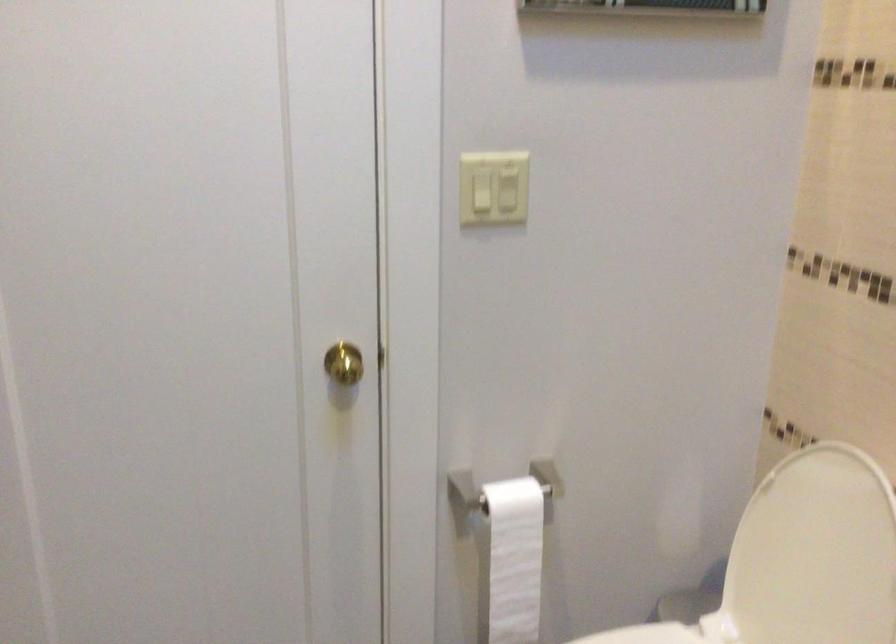
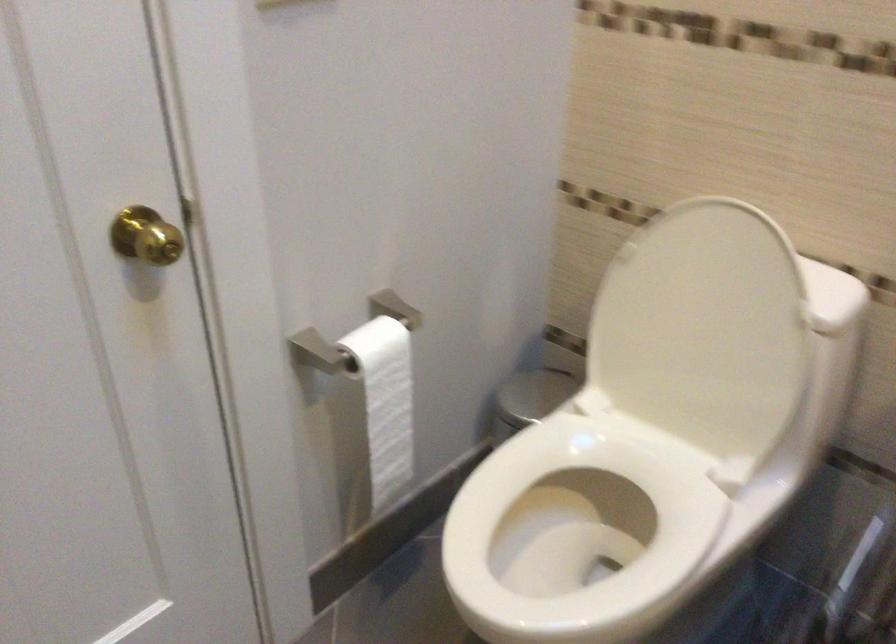
The point at [822,576] is marked in the first image. Where is the corresponding point in the second image?

(702, 330)